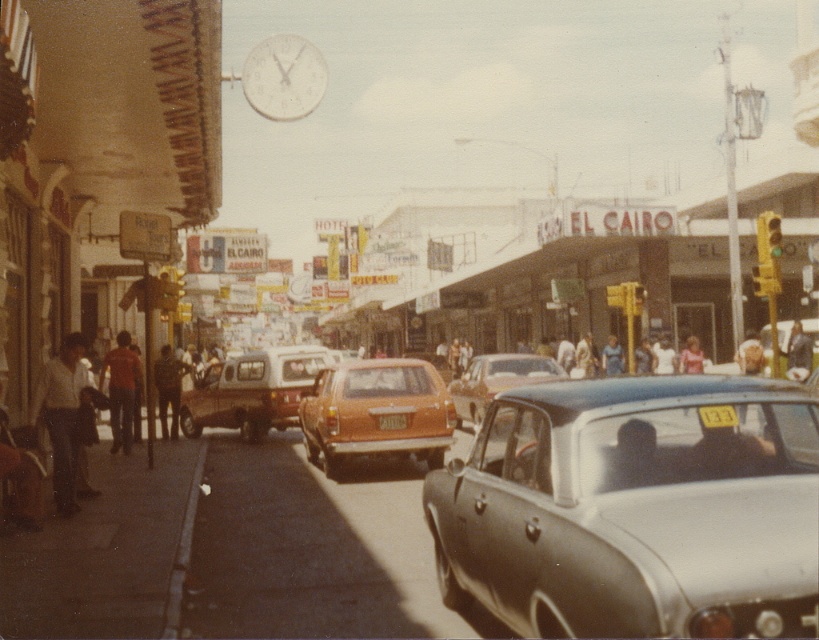
You are a pedestrian standing on the street and want to find the light pink fabric at center. Which direction should you look relative to the white matte clock at upper center?

To locate the light pink fabric at center, look to the right of the white matte clock at upper center since the white matte clock at upper center is positioned to the left of the light pink fabric at center.

You are a delivery person standing on the sidewalk and need to place a package on the roof of the orange matte car at center. The package is 2 feet tall. Can you safely place it there without it touching the dark blue shirt at center?

The orange matte car at center is much taller than the dark blue shirt at center. Since the car is taller, placing a 2 feet tall package on its roof would not interfere with the dark blue shirt at center, so it is safe to do so.

You are a pedestrian standing on the street in the image. You notice the white matte clock at upper center and the light pink fabric at center. Which object is taller?

The white matte clock at upper center is taller than the light pink fabric at center.